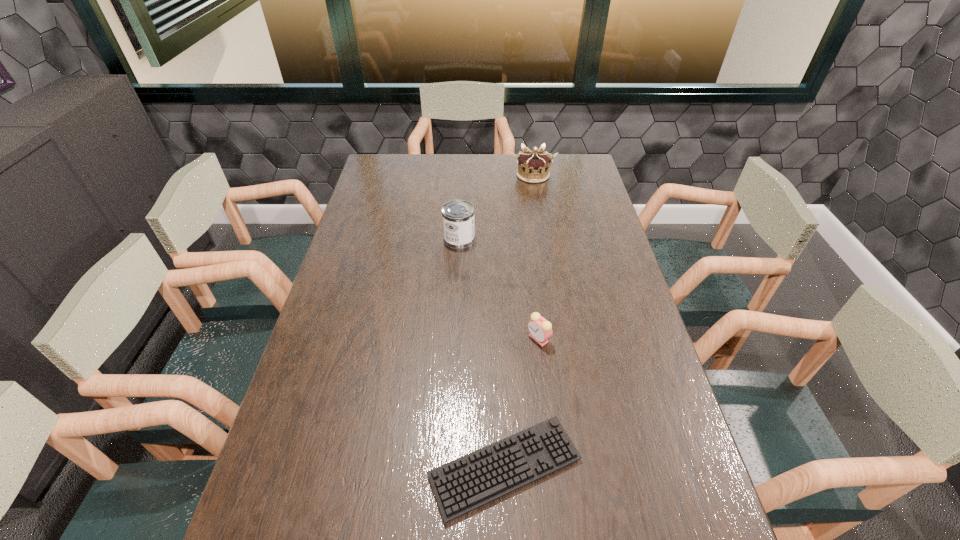
This screenshot has width=960, height=540. In order to click on blank space located 0.100m on the face of the second nearest object in this screenshot , I will do `click(491, 339)`.

Where is `vacant point located 0.360m on the back of the computer keyboard`? The image size is (960, 540). vacant point located 0.360m on the back of the computer keyboard is located at coordinates (498, 307).

The image size is (960, 540). Identify the location of object that is at the far edge. (533, 166).

At what (x,y) coordinates should I click in order to perform the action: click on object located at the right edge. Please return your answer as a coordinate pair (x, y). Looking at the image, I should click on (533, 166).

This screenshot has height=540, width=960. I want to click on object positioned at the far right corner, so click(533, 166).

You are a GUI agent. You are given a task and a screenshot of the screen. Output one action in this format:
    pyautogui.click(x=<x>, y=<y>)
    Task: Click on the vacant region at the far edge
    The image size is (960, 540).
    Given the screenshot: What is the action you would take?
    pyautogui.click(x=418, y=159)

Locate an element on the screen. The image size is (960, 540). free space at the left edge of the desktop is located at coordinates (316, 355).

I want to click on vacant region at the right edge, so click(694, 508).

The image size is (960, 540). I want to click on vacant space that is in between the can and the crown, so point(496,207).

Identify the location of empty space between the can and the alarm clock. (499, 289).